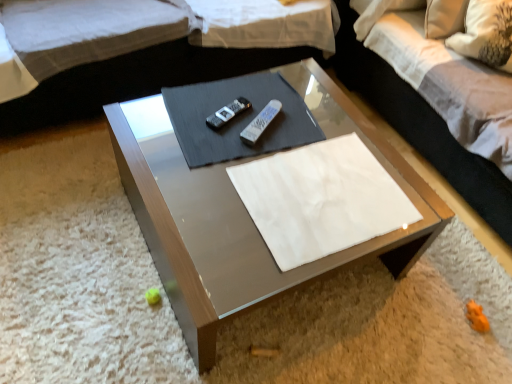
Question: Is white plastic remote at center, which is the second remote from left to right, shorter than metallic glass coffee table at center?

Choices:
 (A) yes
 (B) no

Answer: (A)

Question: Is the position of white plastic remote at center, which is the second remote from left to right, more distant than that of metallic glass coffee table at center?

Choices:
 (A) yes
 (B) no

Answer: (A)

Question: Is white plastic remote at center, acting as the 1th remote starting from the right, oriented away from metallic glass coffee table at center?

Choices:
 (A) no
 (B) yes

Answer: (B)

Question: From a real-world perspective, is white plastic remote at center, acting as the 1th remote starting from the right, positioned over metallic glass coffee table at center based on gravity?

Choices:
 (A) no
 (B) yes

Answer: (B)

Question: Can you confirm if white plastic remote at center, which is the second remote from left to right, is bigger than metallic glass coffee table at center?

Choices:
 (A) no
 (B) yes

Answer: (A)

Question: Considering the positions of white plastic remote at center, acting as the 1th remote starting from the right, and black plastic remote at center, arranged as the second remote when viewed from the right, in the image, is white plastic remote at center, acting as the 1th remote starting from the right, bigger or smaller than black plastic remote at center, arranged as the second remote when viewed from the right,?

Choices:
 (A) big
 (B) small

Answer: (A)

Question: From the image's perspective, is white plastic remote at center, acting as the 1th remote starting from the right, positioned above or below black plastic remote at center, placed as the first remote when sorted from left to right?

Choices:
 (A) above
 (B) below

Answer: (B)

Question: Considering the positions of point (278, 109) and point (209, 125), is point (278, 109) closer or farther from the camera than point (209, 125)?

Choices:
 (A) closer
 (B) farther

Answer: (B)

Question: Is white plastic remote at center, which is the second remote from left to right, inside or outside of black plastic remote at center, arranged as the second remote when viewed from the right?

Choices:
 (A) inside
 (B) outside

Answer: (B)

Question: In terms of size, does black plastic remote at center, placed as the first remote when sorted from left to right, appear bigger or smaller than white fabric pillow at upper right?

Choices:
 (A) big
 (B) small

Answer: (B)

Question: From the image's perspective, is black plastic remote at center, arranged as the second remote when viewed from the right, positioned above or below white fabric pillow at upper right?

Choices:
 (A) below
 (B) above

Answer: (A)

Question: Is black plastic remote at center, placed as the first remote when sorted from left to right, inside the boundaries of white fabric pillow at upper right, or outside?

Choices:
 (A) outside
 (B) inside

Answer: (A)

Question: From a real-world perspective, is black plastic remote at center, placed as the first remote when sorted from left to right, positioned above or below white fabric pillow at upper right?

Choices:
 (A) below
 (B) above

Answer: (A)

Question: From a real-world perspective, is white plastic remote at center, acting as the 1th remote starting from the right, positioned above or below white fabric couch at upper center?

Choices:
 (A) below
 (B) above

Answer: (B)

Question: Is white plastic remote at center, acting as the 1th remote starting from the right, spatially inside white fabric couch at upper center, or outside of it?

Choices:
 (A) outside
 (B) inside

Answer: (A)